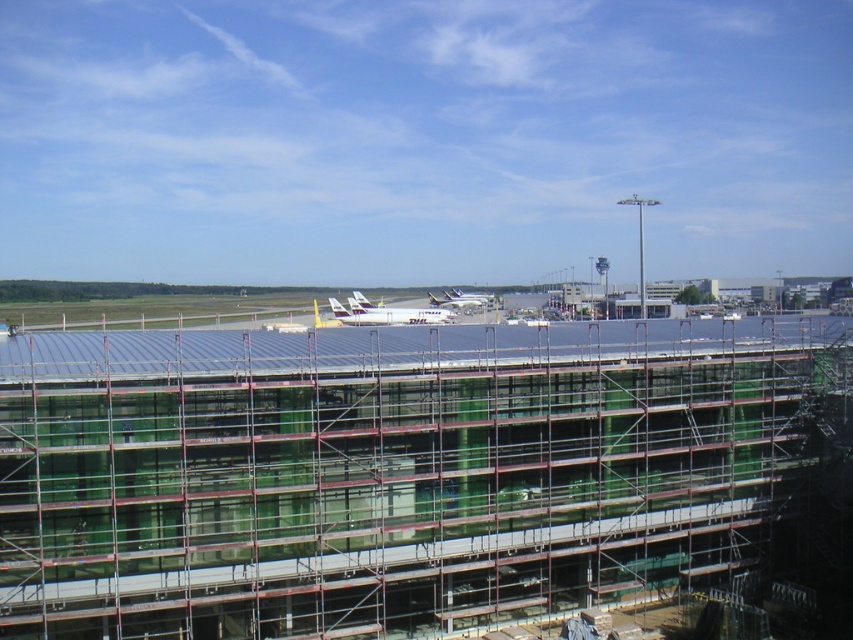
You are an airport engineer assessing the construction site. You see two airplanes, a white matte airplane at center and a white glossy airplane at center. Which airplane requires more space for parking? Please explain your reasoning based on their sizes.

The white matte airplane at center requires more space for parking because it is larger in size than the white glossy airplane at center.

You are standing at the construction site and want to walk towards the two points marked in the image. Which point, point (447, 317) or point (479, 300), will you reach first?

Point (447, 317) is in front of point (479, 300), so you will reach point (447, 317) first.